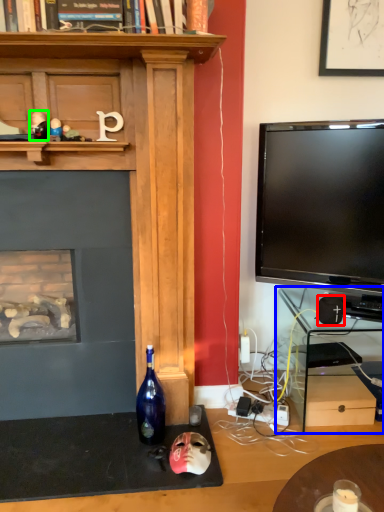
Question: Which is nearer to the speaker (highlighted by a red box)? computer desk (highlighted by a blue box) or toy (highlighted by a green box).

Choices:
 (A) computer desk
 (B) toy

Answer: (A)